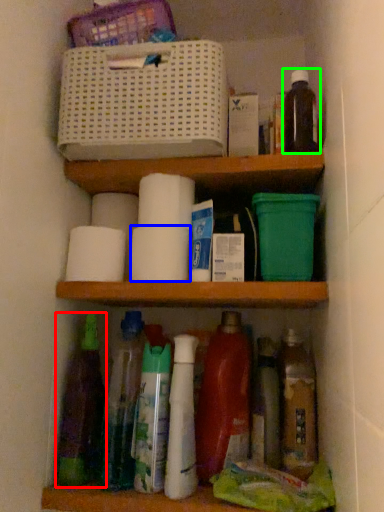
Question: Which object is positioned farthest from bottle (highlighted by a red box)? Select from toilet paper (highlighted by a blue box) and bottle (highlighted by a green box).

Choices:
 (A) toilet paper
 (B) bottle

Answer: (B)